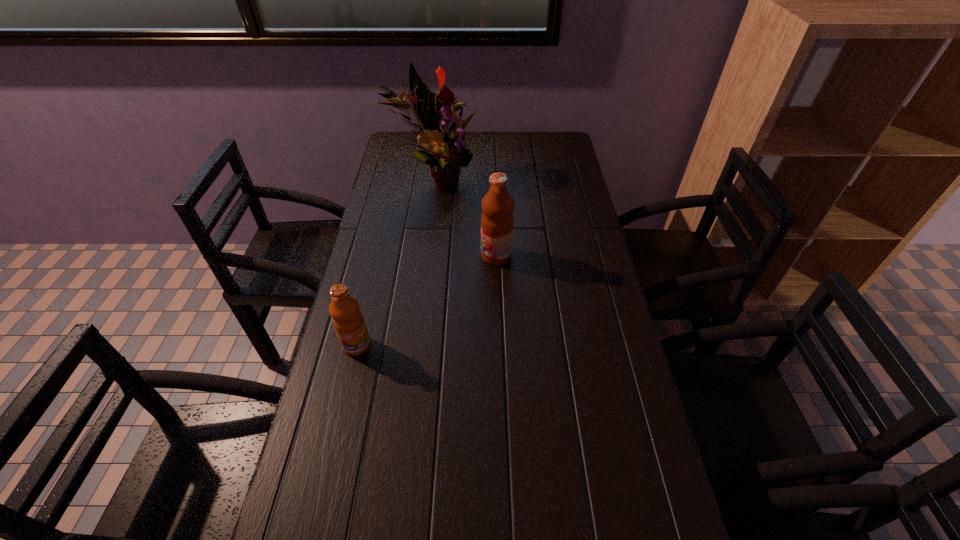
The height and width of the screenshot is (540, 960). Find the location of `unoccupied area between the shortest object and the rightmost object`. unoccupied area between the shortest object and the rightmost object is located at coordinates (426, 300).

You are a GUI agent. You are given a task and a screenshot of the screen. Output one action in this format:
    pyautogui.click(x=<x>, y=<y>)
    Task: Click on the empty space that is in between the rightmost object and the shortest object
    Image resolution: width=960 pixels, height=540 pixels.
    Given the screenshot: What is the action you would take?
    pyautogui.click(x=426, y=300)

You are a GUI agent. You are given a task and a screenshot of the screen. Output one action in this format:
    pyautogui.click(x=<x>, y=<y>)
    Task: Click on the unoccupied area between the right fruit juice and the nearest object
    
    Given the screenshot: What is the action you would take?
    pyautogui.click(x=426, y=300)

This screenshot has height=540, width=960. In order to click on vacant region between the tallest object and the shortest object in this screenshot , I will do `click(396, 264)`.

Locate which object ranks in proximity to the taller fruit juice. Please provide its 2D coordinates. Your answer should be formatted as a tuple, i.e. [(x, y)], where the tuple contains the x and y coordinates of a point satisfying the conditions above.

[(448, 154)]

I want to click on object that can be found as the second closest to the second shortest object, so click(x=348, y=321).

You are a GUI agent. You are given a task and a screenshot of the screen. Output one action in this format:
    pyautogui.click(x=<x>, y=<y>)
    Task: Click on the free spot that satisfies the following two spatial constraints: 1. on the front label of the rightmost object; 2. on the label side of the nearest object
    The width and height of the screenshot is (960, 540).
    Given the screenshot: What is the action you would take?
    pyautogui.click(x=499, y=345)

I want to click on free space that satisfies the following two spatial constraints: 1. on the front-facing side of the bouquet; 2. on the label side of the shortest object, so click(414, 345).

Identify the location of vacant region that satisfies the following two spatial constraints: 1. on the front-facing side of the farthest object; 2. on the label side of the shortest object. point(414,345).

You are a GUI agent. You are given a task and a screenshot of the screen. Output one action in this format:
    pyautogui.click(x=<x>, y=<y>)
    Task: Click on the free point that satisfies the following two spatial constraints: 1. on the front label of the second shortest object; 2. on the label side of the nearest object
    The height and width of the screenshot is (540, 960).
    Given the screenshot: What is the action you would take?
    (x=499, y=345)